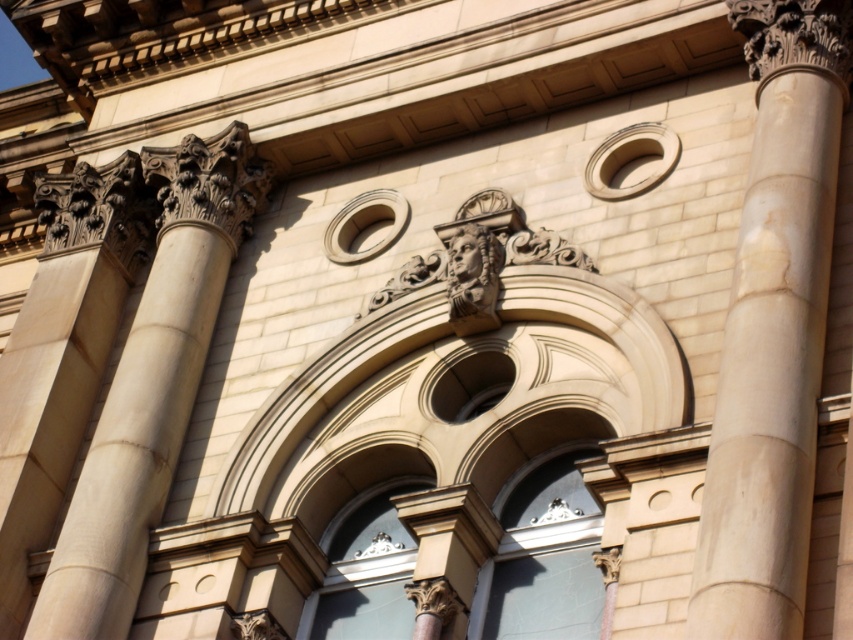
Which of these two, beige stone column at left or carved stone face at center, stands taller?

Standing taller between the two is beige stone column at left.

Is beige stone column at left positioned before carved stone face at center?

Yes, it is.

The height and width of the screenshot is (640, 853). Describe the element at coordinates (149, 387) in the screenshot. I see `beige stone column at left` at that location.

Image resolution: width=853 pixels, height=640 pixels. I want to click on beige stone column at left, so click(149, 387).

Who is higher up, beige marble column at center or carved stone face at center?

carved stone face at center is higher up.

In the scene shown: Does beige marble column at center appear on the left side of carved stone face at center?

Incorrect, beige marble column at center is not on the left side of carved stone face at center.

Who is more distant from viewer, (793,118) or (480,326)?

The point (480,326) is behind.

At what (x,y) coordinates should I click in order to perform the action: click on beige marble column at center. Please return your answer as a coordinate pair (x, y). The width and height of the screenshot is (853, 640). Looking at the image, I should click on (773, 326).

From the picture: Can you confirm if beige marble column at center is positioned below beige stone column at left?

Incorrect, beige marble column at center is not positioned below beige stone column at left.

Between beige marble column at center and beige stone column at left, which one appears on the right side from the viewer's perspective?

beige marble column at center is more to the right.

Between point (828, 108) and point (167, 259), which one is positioned behind?

Positioned behind is point (167, 259).

Where is `beige marble column at center`? beige marble column at center is located at coordinates (773, 326).